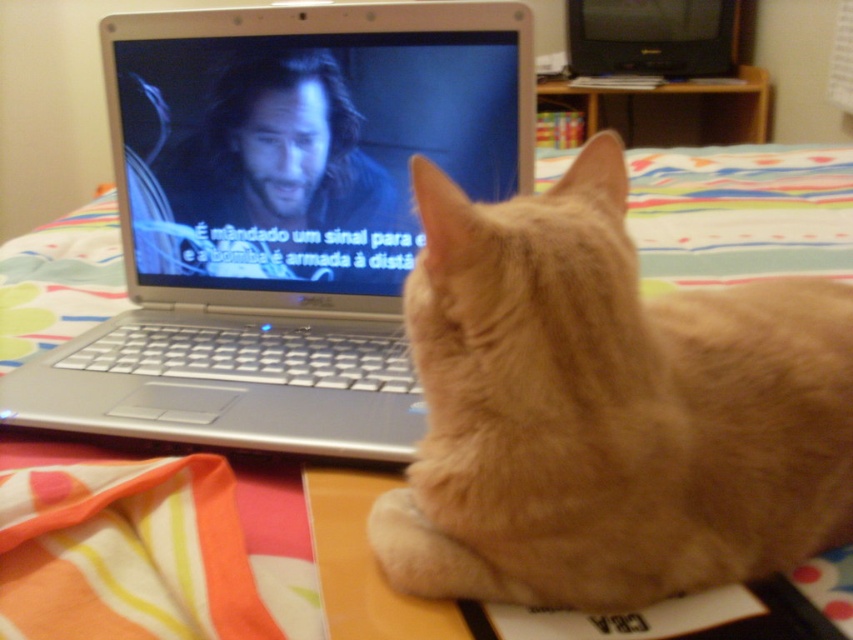
Question: Which point is farther to the camera?

Choices:
 (A) (505, 392)
 (B) (717, 24)
 (C) (438, 115)

Answer: (B)

Question: Considering the relative positions of silver metallic laptop at center and black plastic television at upper right in the image provided, where is silver metallic laptop at center located with respect to black plastic television at upper right?

Choices:
 (A) above
 (B) below

Answer: (B)

Question: Is silver metallic laptop at center positioned behind black plastic television at upper right?

Choices:
 (A) yes
 (B) no

Answer: (B)

Question: Which point is farther to the camera?

Choices:
 (A) black plastic television at upper right
 (B) silver metallic laptop at center

Answer: (A)

Question: Which point is farther to the camera?

Choices:
 (A) (764, 435)
 (B) (729, 42)
 (C) (158, 88)

Answer: (B)

Question: Does silver metallic laptop at center have a smaller size compared to black plastic television at upper right?

Choices:
 (A) no
 (B) yes

Answer: (B)